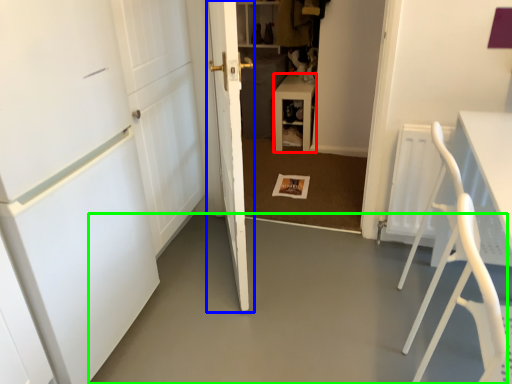
Question: Estimate the real-world distances between objects in this image. Which object is closer to furniture (highlighted by a red box), door (highlighted by a blue box) or concrete (highlighted by a green box)?

Choices:
 (A) door
 (B) concrete

Answer: (A)